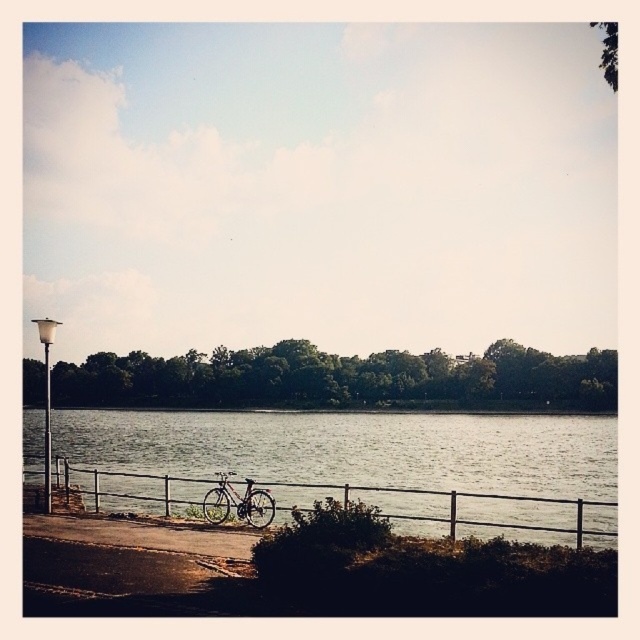
Does point (262, 525) come behind point (48, 321)?

No.

This screenshot has width=640, height=640. Describe the element at coordinates (237, 502) in the screenshot. I see `shiny silver bicycle at lower center` at that location.

Measure the distance between point (240, 506) and camera.

53.01 feet

The image size is (640, 640). In order to click on shiny silver bicycle at lower center in this screenshot , I will do `click(237, 502)`.

Consider the image. Who is taller, metallic silver fence at lower center or shiny silver bicycle at lower center?

metallic silver fence at lower center is taller.

Which is above, metallic silver fence at lower center or shiny silver bicycle at lower center?

Positioned higher is shiny silver bicycle at lower center.

Is point (113, 472) behind point (262, 488)?

Yes.

The image size is (640, 640). I want to click on metallic silver fence at lower center, so click(464, 509).

Who is positioned more to the left, metallic silver fence at lower center or white glossy lamp post at left?

white glossy lamp post at left is more to the left.

Is point (173, 492) farther from viewer compared to point (35, 317)?

No.

Where is `metallic silver fence at lower center`? metallic silver fence at lower center is located at coordinates (464, 509).